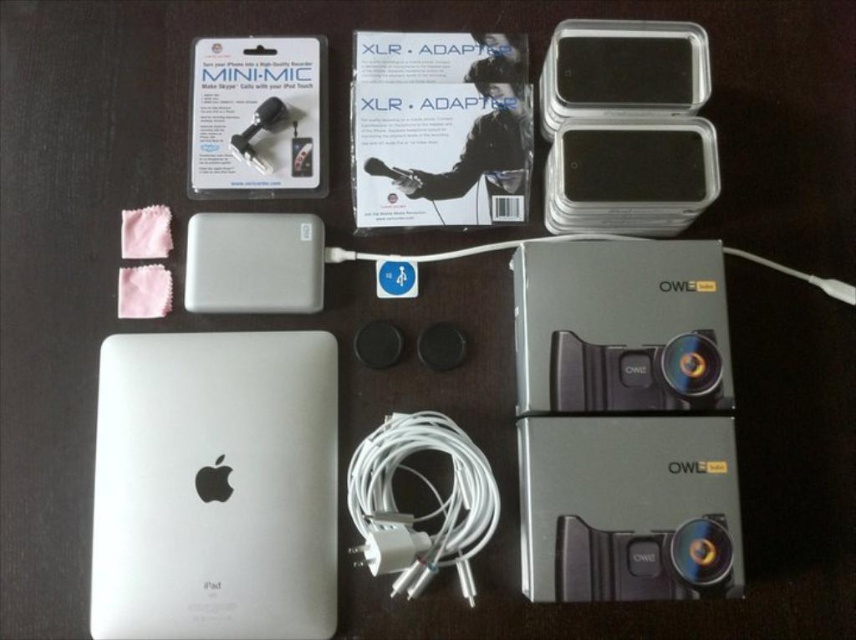
Question: Which object is closer to the camera taking this photo?

Choices:
 (A) silver matte ipad at lower left
 (B) matte black mini-mic at upper left
 (C) metallic gray camera at center
 (D) silver metallic power bank at center-left

Answer: (C)

Question: Which object appears closest to the camera in this image?

Choices:
 (A) silver metallic power bank at center-left
 (B) metallic gray camera at center
 (C) black glossy ipod at upper right

Answer: (B)

Question: Does matte black mini-mic at upper left appear on the left side of black glossy ipod at upper right?

Choices:
 (A) yes
 (B) no

Answer: (A)

Question: Is metallic gray camera at center positioned in front of silver matte ipad at lower left?

Choices:
 (A) no
 (B) yes

Answer: (B)

Question: Is metallic gray camera at center above black glossy ipod at upper right?

Choices:
 (A) no
 (B) yes

Answer: (A)

Question: Which object is the farthest from the silver metallic power bank at center-left?

Choices:
 (A) black plastic ipod at upper right
 (B) black glossy ipod at upper right
 (C) matte black mini-mic at upper left
 (D) silver matte ipad at lower left

Answer: (B)